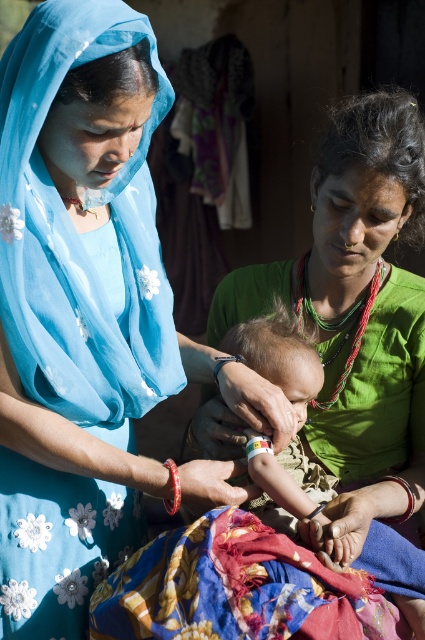
Looking at this image, does blue fabric headscarf at upper left appear on the right side of green fabric at center?

No, blue fabric headscarf at upper left is not to the right of green fabric at center.

The height and width of the screenshot is (640, 425). In order to click on blue fabric headscarf at upper left in this screenshot , I will do `click(85, 230)`.

You are a GUI agent. You are given a task and a screenshot of the screen. Output one action in this format:
    pyautogui.click(x=<x>, y=<y>)
    Task: Click on the blue fabric headscarf at upper left
    Image resolution: width=425 pixels, height=640 pixels.
    Given the screenshot: What is the action you would take?
    pyautogui.click(x=85, y=230)

Between green fabric at center and multicolored fabric at lower center, which one appears on the left side from the viewer's perspective?

multicolored fabric at lower center

Which of these two, green fabric at center or multicolored fabric at lower center, stands taller?

Standing taller between the two is green fabric at center.

Which is in front, point (246, 305) or point (226, 586)?

Point (226, 586)

This screenshot has height=640, width=425. In order to click on green fabric at center in this screenshot , I will do `click(357, 310)`.

Is blue fabric headscarf at upper left positioned before multicolored fabric at lower center?

No, it is behind multicolored fabric at lower center.

How far apart are blue fabric headscarf at upper left and multicolored fabric at lower center?

blue fabric headscarf at upper left and multicolored fabric at lower center are 18.26 inches apart.

Between point (115, 86) and point (258, 557), which one is positioned behind?

The point (115, 86) is behind.

Identify the location of blue fabric headscarf at upper left. The height and width of the screenshot is (640, 425). (85, 230).